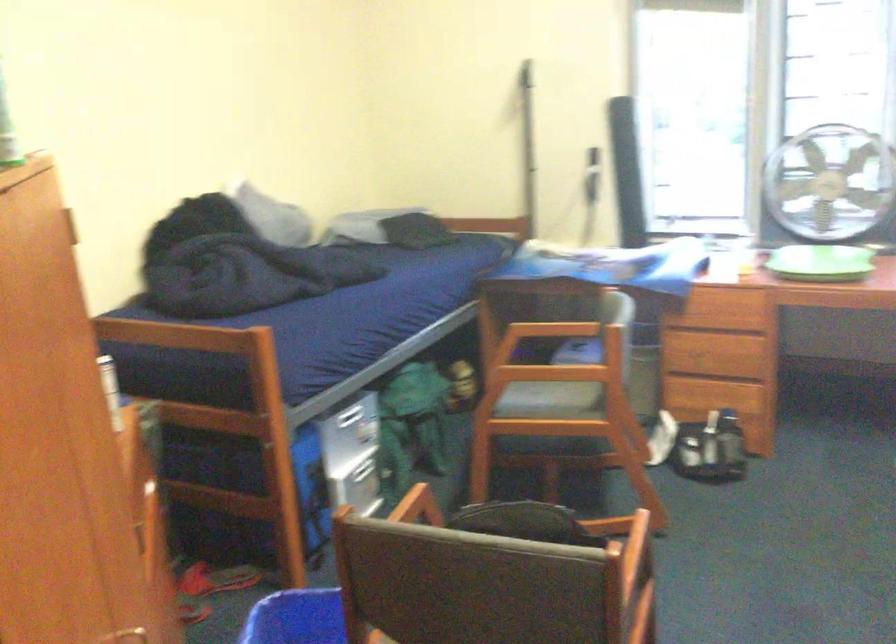
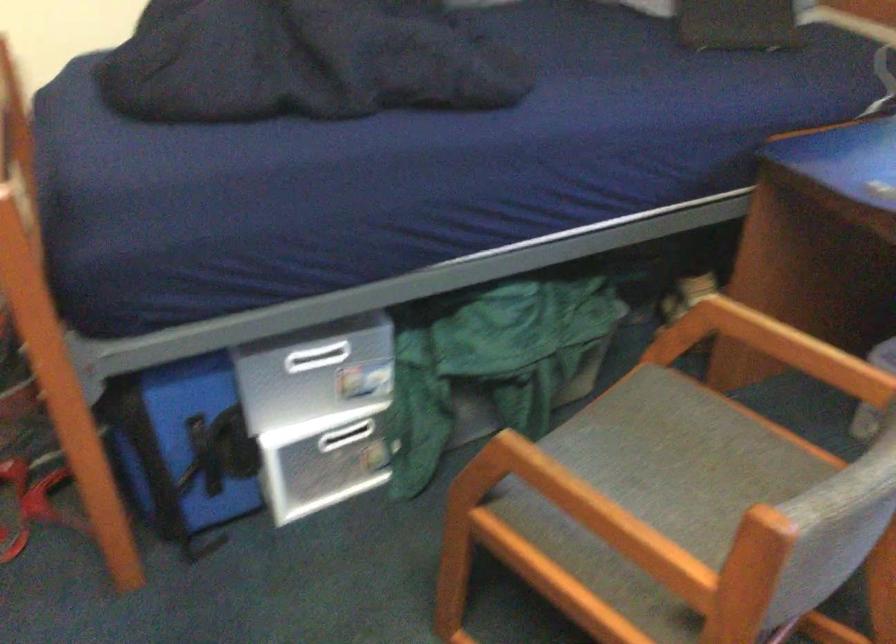
Find the pixel in the second image that matches point 355,476 in the first image.

(345, 436)